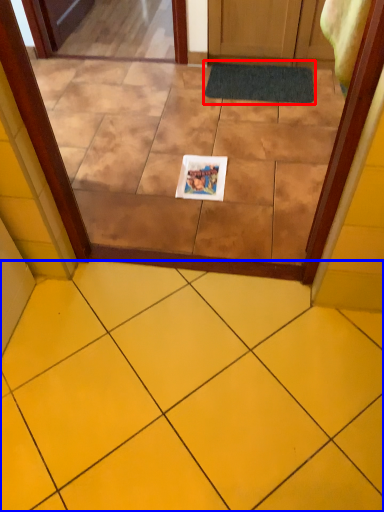
Question: Which point is further to the camera, bath mat (highlighted by a red box) or ceramic tile (highlighted by a blue box)?

Choices:
 (A) bath mat
 (B) ceramic tile

Answer: (A)